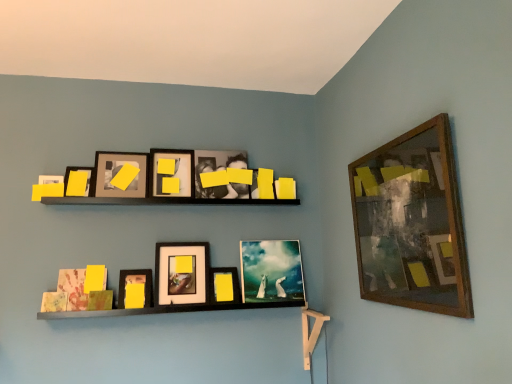
Question: Is matte glass painting at center, which is the 2th picture frame in right-to-left order, inside the boundaries of wooden-framed artwork at upper right, which appears as the 1th picture frame when viewed from the right, or outside?

Choices:
 (A) inside
 (B) outside

Answer: (B)

Question: Relative to wooden-framed artwork at upper right, placed as the ninth picture frame when sorted from left to right, is matte glass painting at center, the 8th picture frame in the left-to-right sequence, in front or behind?

Choices:
 (A) behind
 (B) front

Answer: (A)

Question: Which object is positioned farthest from the matte black picture frame at upper center, the fourth picture frame in the left-to-right sequence?

Choices:
 (A) wooden shelf at center
 (B) wooden-framed artwork at upper right, which appears as the 1th picture frame when viewed from the right
 (C) matte yellow paper at lower center, which ranks as the 7th picture frame in right-to-left order
 (D) matte glass painting at center, the 8th picture frame in the left-to-right sequence
 (E) matte black picture frame at upper left, positioned as the 1th picture frame in left-to-right order

Answer: (B)

Question: Based on their relative distances, which object is nearer to the matte yellow paper at lower center, which ranks as the 7th picture frame in right-to-left order?

Choices:
 (A) yellow matte picture frame at center, which appears as the third picture frame when viewed from the right
 (B) wooden shelf at center
 (C) matte black picture frame at upper left, which appears as the 8th picture frame when viewed from the right
 (D) matte black photo frame at upper center, which appears as the 6th picture frame when viewed from the left
 (E) wooden-framed artwork at upper right, placed as the ninth picture frame when sorted from left to right

Answer: (B)